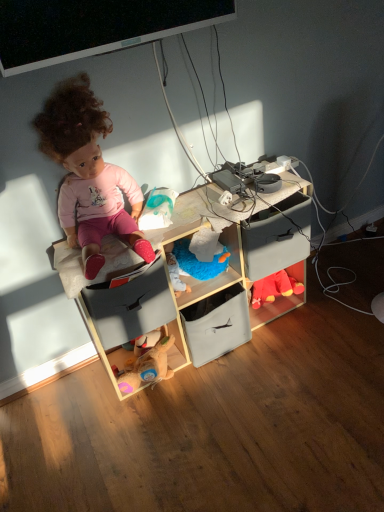
Question: Can you confirm if velvet red plush toy at lower right, positioned as the 1th toy in back-to-front order, is positioned to the left of matte gray drawer at center, which is the 1th drawer in right-to-left order?

Choices:
 (A) no
 (B) yes

Answer: (A)

Question: Is velvet red plush toy at lower right, placed as the second toy when sorted from left to right, not near matte gray drawer at center, which is the 1th drawer in right-to-left order?

Choices:
 (A) yes
 (B) no

Answer: (B)

Question: From the image's perspective, is velvet red plush toy at lower right, which appears as the 2th toy when viewed from the top, on matte gray drawer at center, which appears as the 2th drawer when viewed from the left?

Choices:
 (A) no
 (B) yes

Answer: (A)

Question: Does velvet red plush toy at lower right, positioned as the 1th toy in back-to-front order, have a lesser height compared to matte gray drawer at center, which appears as the 2th drawer when viewed from the left?

Choices:
 (A) no
 (B) yes

Answer: (B)

Question: Can you confirm if velvet red plush toy at lower right, which appears as the 2th toy when viewed from the top, is wider than matte gray drawer at center, which appears as the 2th drawer when viewed from the left?

Choices:
 (A) yes
 (B) no

Answer: (B)

Question: Based on their sizes in the image, would you say matte pink doll at upper left is bigger or smaller than matte plastic bag at center, which is the 1th toy from top to bottom?

Choices:
 (A) small
 (B) big

Answer: (B)

Question: Looking at their shapes, would you say matte pink doll at upper left is wider or thinner than matte plastic bag at center, the 2th toy viewed from the right?

Choices:
 (A) wide
 (B) thin

Answer: (A)

Question: From a real-world perspective, is matte pink doll at upper left physically located above or below matte plastic bag at center, the second toy in the bottom-to-top sequence?

Choices:
 (A) above
 (B) below

Answer: (A)

Question: From the image's perspective, is matte pink doll at upper left located above or below matte plastic bag at center, which is the 1th toy from top to bottom?

Choices:
 (A) below
 (B) above

Answer: (B)

Question: Considering the positions of soft fabric storage at center, marked as the first shelf in a right-to-left arrangement, and wooden cube at center, arranged as the 1th shelf when viewed from the left, in the image, is soft fabric storage at center, marked as the first shelf in a right-to-left arrangement, taller or shorter than wooden cube at center, arranged as the 1th shelf when viewed from the left,?

Choices:
 (A) short
 (B) tall

Answer: (A)

Question: Based on their positions, is soft fabric storage at center, marked as the first shelf in a right-to-left arrangement, located to the left or right of wooden cube at center, arranged as the 1th shelf when viewed from the left?

Choices:
 (A) left
 (B) right

Answer: (B)

Question: Looking at their shapes, would you say soft fabric storage at center, positioned as the second shelf in left-to-right order, is wider or thinner than wooden cube at center, the second shelf from the right?

Choices:
 (A) thin
 (B) wide

Answer: (A)

Question: Relative to wooden cube at center, the second shelf from the right, is soft fabric storage at center, marked as the first shelf in a right-to-left arrangement, in front or behind?

Choices:
 (A) front
 (B) behind

Answer: (B)

Question: From their relative heights in the image, would you say matte pink doll at upper left is taller or shorter than matte gray drawer at center, which is the 1th drawer in right-to-left order?

Choices:
 (A) short
 (B) tall

Answer: (B)

Question: Is point (87, 142) closer or farther from the camera than point (284, 200)?

Choices:
 (A) closer
 (B) farther

Answer: (A)